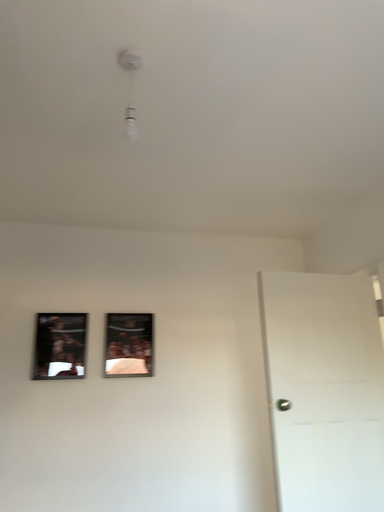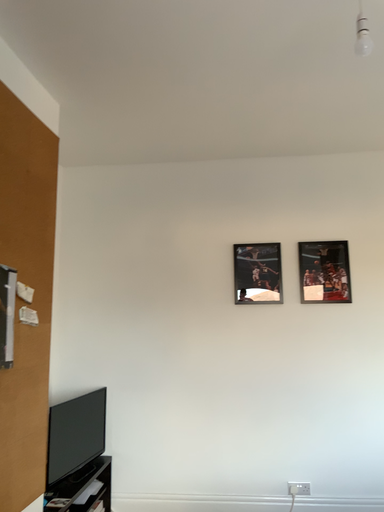
Question: How did the camera likely rotate when shooting the video?

Choices:
 (A) rotated right
 (B) rotated left

Answer: (B)